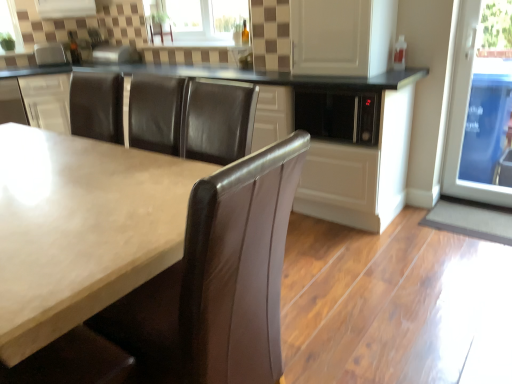
Question: Would you say white glossy cabinet at upper center is outside satin silver toaster at upper left?

Choices:
 (A) no
 (B) yes

Answer: (B)

Question: Can you confirm if white glossy cabinet at upper center is taller than satin silver toaster at upper left?

Choices:
 (A) yes
 (B) no

Answer: (A)

Question: Does white glossy cabinet at upper center appear on the left side of satin silver toaster at upper left?

Choices:
 (A) no
 (B) yes

Answer: (A)

Question: From a real-world perspective, is white glossy cabinet at upper center below satin silver toaster at upper left?

Choices:
 (A) yes
 (B) no

Answer: (B)

Question: From a real-world perspective, is white glossy cabinet at upper center on satin silver toaster at upper left?

Choices:
 (A) no
 (B) yes

Answer: (B)

Question: Is transparent glass door at right wider or thinner than matte white countertop at center?

Choices:
 (A) wide
 (B) thin

Answer: (B)

Question: Is transparent glass door at right to the left or to the right of matte white countertop at center in the image?

Choices:
 (A) left
 (B) right

Answer: (B)

Question: From a real-world perspective, relative to matte white countertop at center, is transparent glass door at right vertically above or below?

Choices:
 (A) below
 (B) above

Answer: (B)

Question: Is transparent glass door at right bigger or smaller than matte white countertop at center?

Choices:
 (A) big
 (B) small

Answer: (B)

Question: From a real-world perspective, is clear glass window at upper center physically located above or below satin silver toaster at upper left?

Choices:
 (A) above
 (B) below

Answer: (A)

Question: From the image's perspective, is clear glass window at upper center positioned above or below satin silver toaster at upper left?

Choices:
 (A) above
 (B) below

Answer: (A)

Question: Looking at their shapes, would you say clear glass window at upper center is wider or thinner than satin silver toaster at upper left?

Choices:
 (A) wide
 (B) thin

Answer: (B)

Question: Visually, is clear glass window at upper center positioned to the left or to the right of satin silver toaster at upper left?

Choices:
 (A) left
 (B) right

Answer: (B)

Question: Is clear glass window at upper center situated inside matte white countertop at center or outside?

Choices:
 (A) outside
 (B) inside

Answer: (A)

Question: Considering their positions, is clear glass window at upper center located in front of or behind matte white countertop at center?

Choices:
 (A) front
 (B) behind

Answer: (B)